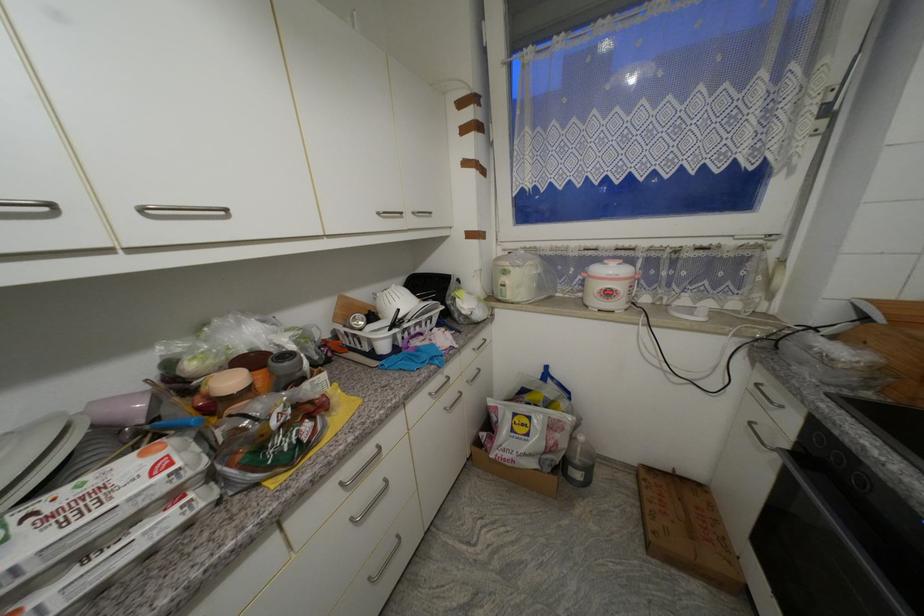
You are a GUI agent. You are given a task and a screenshot of the screen. Output one action in this format:
    pyautogui.click(x=<x>, y=<y>)
    Task: Click on the large bottle handle
    
    Given the screenshot: What is the action you would take?
    click(181, 211)